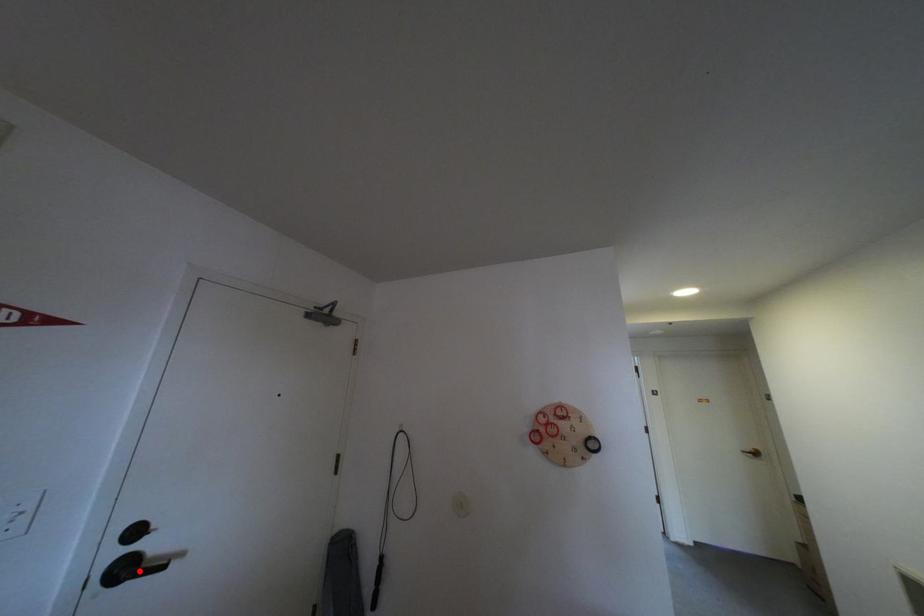
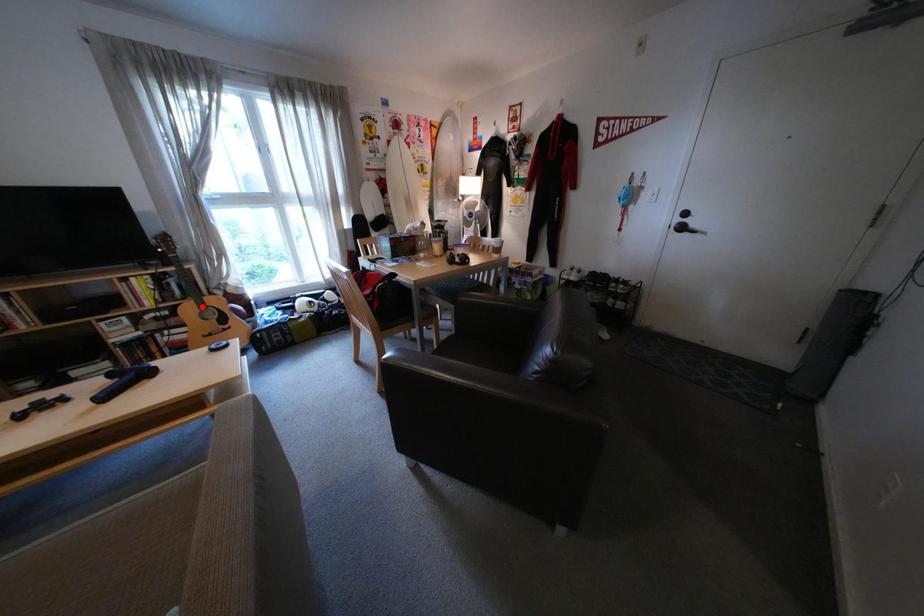
I am providing you with two images of the same scene from different viewpoints. A red point is marked on the first image and another point is marked on the second image. Are the points marked in image1 and image2 representing the same 3D position?

No